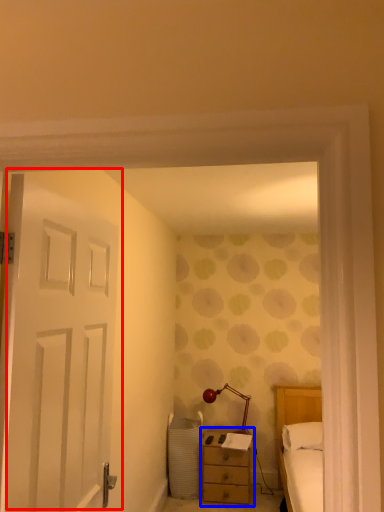
Question: Which of the following is the closest to the observer, door (highlighted by a red box) or nightstand (highlighted by a blue box)?

Choices:
 (A) door
 (B) nightstand

Answer: (A)